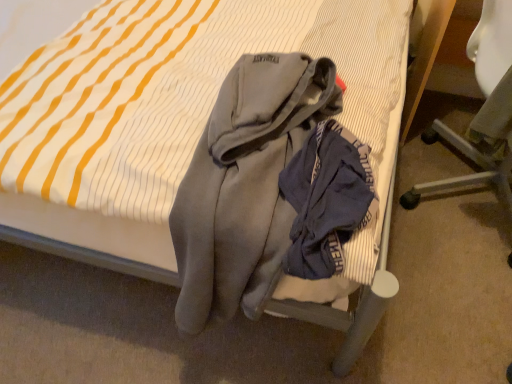
Question: From the image's perspective, is gray fleece hoodie at center positioned above or below white plastic chair at upper right?

Choices:
 (A) below
 (B) above

Answer: (A)

Question: Is gray fleece hoodie at center bigger or smaller than white plastic chair at upper right?

Choices:
 (A) small
 (B) big

Answer: (A)

Question: Is gray fleece hoodie at center inside or outside of white plastic chair at upper right?

Choices:
 (A) inside
 (B) outside

Answer: (B)

Question: Choose the correct answer: Is white plastic chair at upper right inside gray fleece hoodie at center or outside it?

Choices:
 (A) inside
 (B) outside

Answer: (B)

Question: Considering the relative positions of white plastic chair at upper right and gray fleece hoodie at center in the image provided, is white plastic chair at upper right to the left or to the right of gray fleece hoodie at center?

Choices:
 (A) left
 (B) right

Answer: (B)

Question: In terms of height, does white plastic chair at upper right look taller or shorter compared to gray fleece hoodie at center?

Choices:
 (A) short
 (B) tall

Answer: (B)

Question: Is point (424, 142) closer or farther from the camera than point (313, 119)?

Choices:
 (A) farther
 (B) closer

Answer: (A)